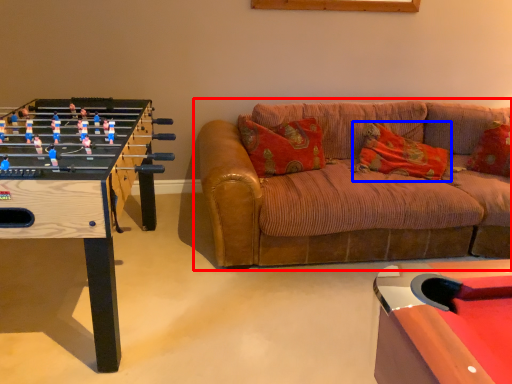
Question: Which point is further to the camera, studio couch (highlighted by a red box) or pillow (highlighted by a blue box)?

Choices:
 (A) studio couch
 (B) pillow

Answer: (B)